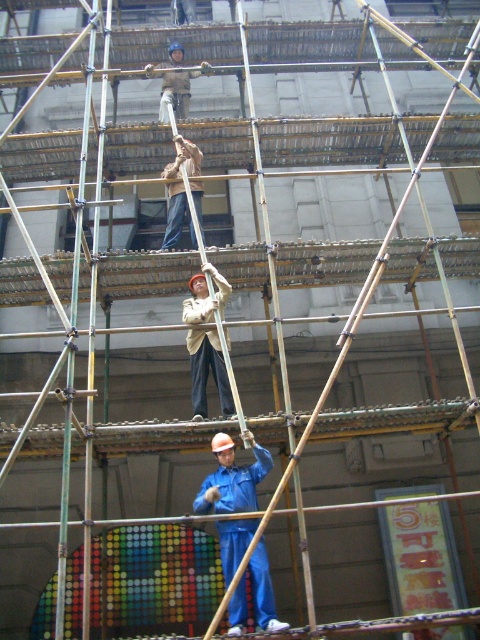
Does blue matte jumpsuit at center have a lesser height compared to light beige fabric jacket at center?

Incorrect, blue matte jumpsuit at center's height does not fall short of light beige fabric jacket at center's.

Which is more to the right, blue matte jumpsuit at center or light beige fabric jacket at center?

Positioned to the right is blue matte jumpsuit at center.

Does point (236, 634) lie in front of point (216, 294)?

That is True.

You are a GUI agent. You are given a task and a screenshot of the screen. Output one action in this format:
    pyautogui.click(x=<x>, y=<y>)
    Task: Click on the blue matte jumpsuit at center
    
    Given the screenshot: What is the action you would take?
    pyautogui.click(x=231, y=477)

Between blue matte jumpsuit at center and light brown fabric construction worker at upper center, which one is positioned lower?

Positioned lower is blue matte jumpsuit at center.

Who is taller, blue matte jumpsuit at center or light brown fabric construction worker at upper center?

blue matte jumpsuit at center

The image size is (480, 640). Find the location of `blue matte jumpsuit at center`. blue matte jumpsuit at center is located at coordinates (231, 477).

Is green bamboo scaffolding at center thinner than blue matte jumpsuit at center?

No.

Which is more to the right, green bamboo scaffolding at center or blue matte jumpsuit at center?

Positioned to the right is blue matte jumpsuit at center.

This screenshot has height=640, width=480. What are the coordinates of `green bamboo scaffolding at center` in the screenshot? It's located at (64, 332).

Locate an element on the screen. This screenshot has height=640, width=480. green bamboo scaffolding at center is located at coordinates (64, 332).